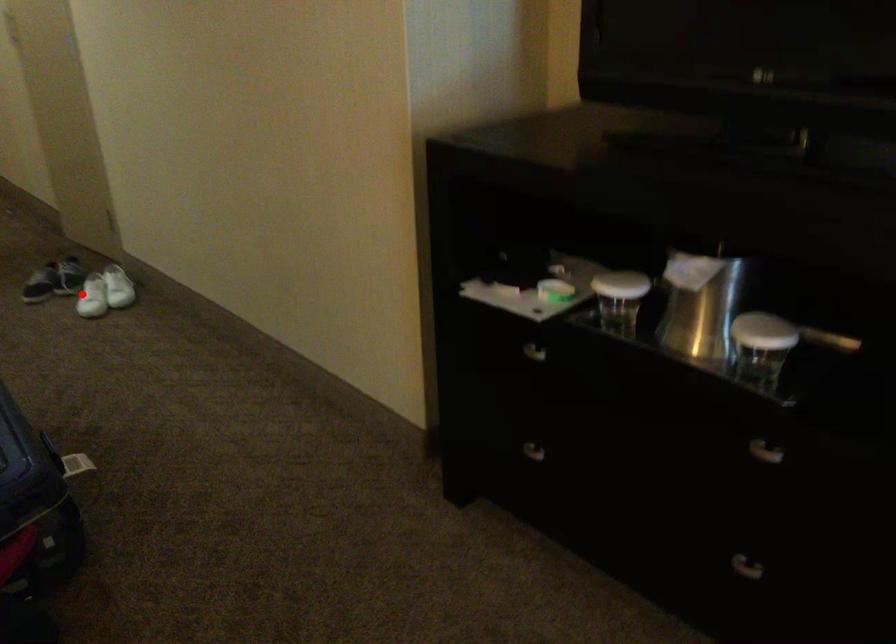
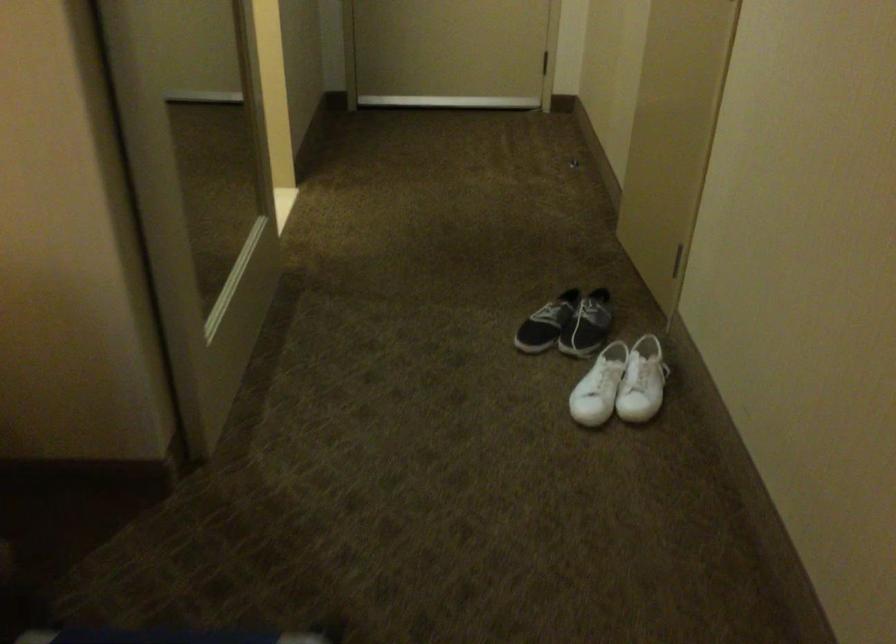
Question: A red point is marked in image1. In image2, is the corresponding 3D point closer to the camera or farther? Reply with the corresponding letter.

Choices:
 (A) The corresponding 3D point is closer.
 (B) The corresponding 3D point is farther.

Answer: (A)